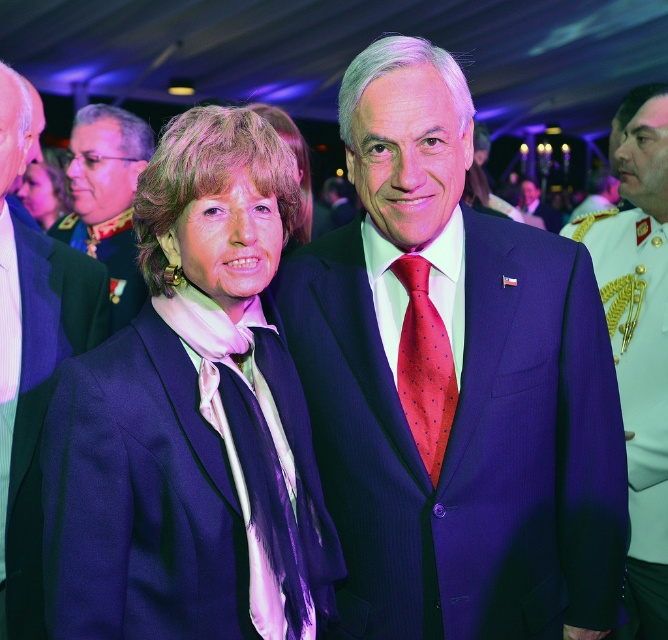
Who is positioned more to the right, green wool suit at left or green military uniform at center?

green wool suit at left is more to the right.

Does green wool suit at left have a smaller size compared to green military uniform at center?

Yes.

This screenshot has height=640, width=668. What do you see at coordinates (31, 362) in the screenshot? I see `green wool suit at left` at bounding box center [31, 362].

What are the coordinates of `green wool suit at left` in the screenshot? It's located at [x=31, y=362].

Is green wool suit at left above polka dot silk tie at center?

Yes, green wool suit at left is above polka dot silk tie at center.

Does point (31, 342) come behind point (401, 371)?

Yes, it is.

Locate an element on the screen. The width and height of the screenshot is (668, 640). green wool suit at left is located at coordinates (31, 362).

Does point (438, 250) lie behind point (41, 227)?

No, (438, 250) is in front of (41, 227).

Is point (492, 257) less distant than point (19, 196)?

Yes, point (492, 257) is in front of point (19, 196).

Is point (442, 339) closer to viewer compared to point (43, 205)?

Yes, point (442, 339) is in front of point (43, 205).

The height and width of the screenshot is (640, 668). Find the location of `navy blue suit at center`. navy blue suit at center is located at coordinates (454, 385).